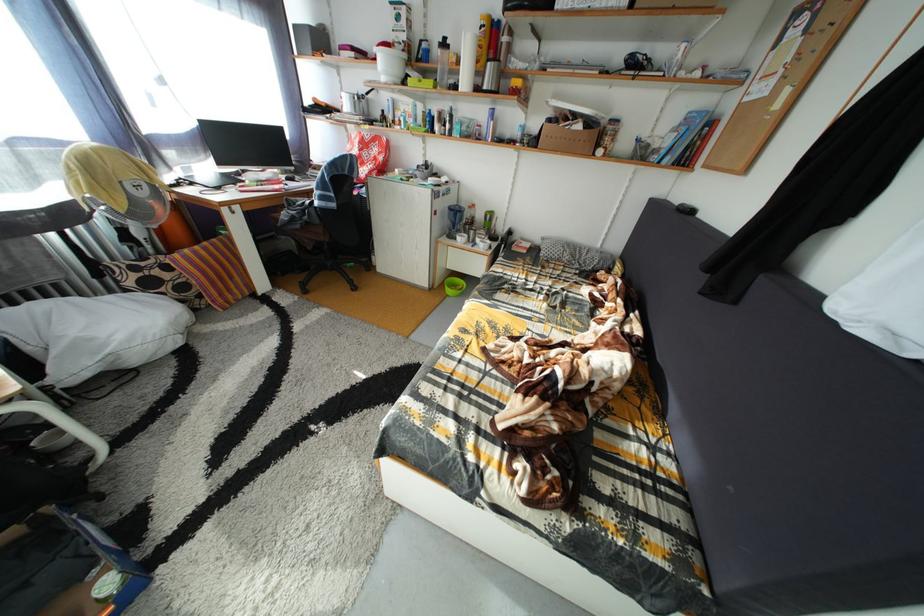
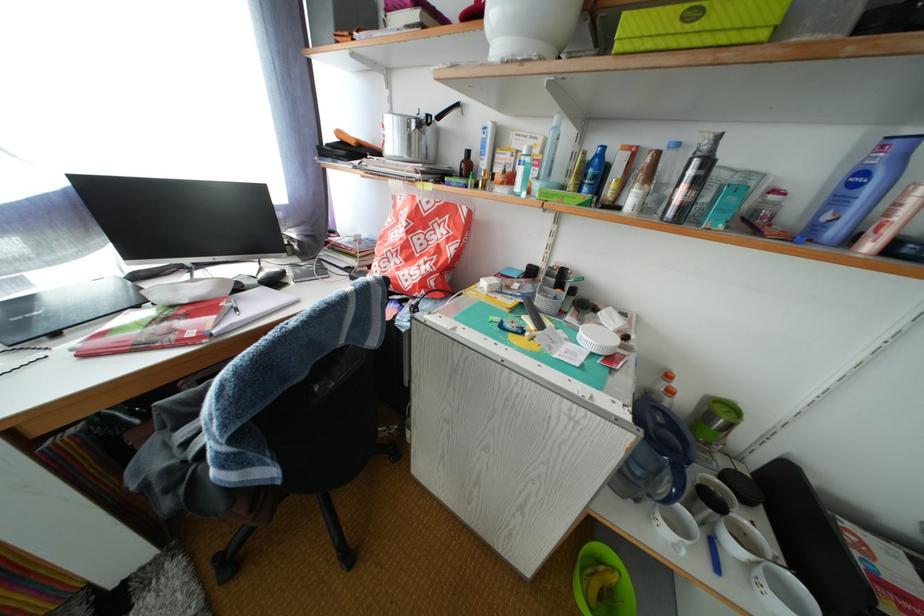
In a continuous first-person perspective shot, in which direction is the camera moving?

The movement direction of the cameraman is left, forward.